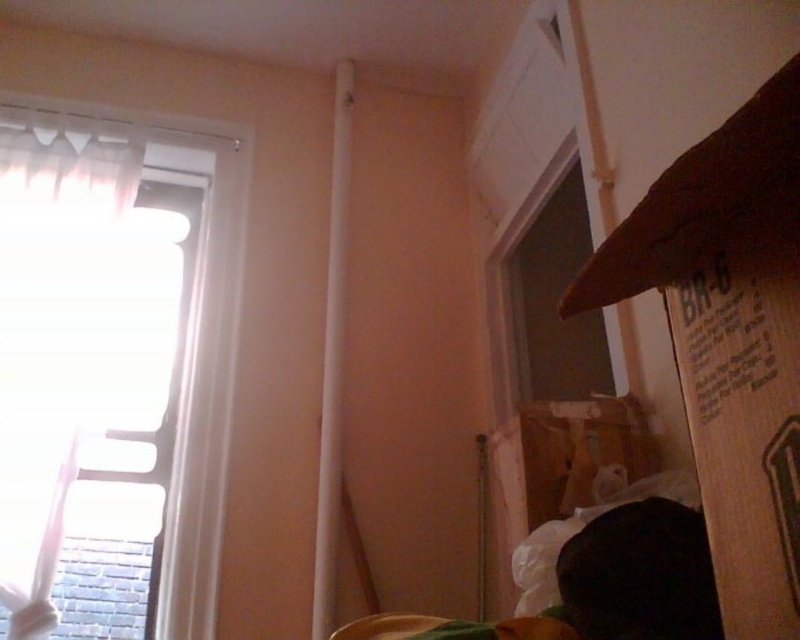
Based on the photo, you are moving a brown cardboard box at lower right into a room with a white sheer curtain at left. If you want to place the box near the window, which side of the curtain should you position it on?

The brown cardboard box at lower right should be placed to the right of the white sheer curtain at left since the curtain is already positioned to the left of the box.

You are moving a brown cardboard box at lower right into a room with a white sheer curtain at left. The box is 3 feet wide. Is there enough space between the box and the curtain to move it without touching either?

The white sheer curtain at left is 3.63 feet away from the brown cardboard box at lower right. Since the box is 3 feet wide, there is sufficient space between them to move it without touching either.

In the scene shown: You are moving into a new apartment and have two brown cardboard boxes to place in the room. The brown cardboard box at right and the brown cardboard box at lower right. Which box should you choose if you need to store smaller items?

The brown cardboard box at right is smaller than the brown cardboard box at lower right, so you should choose the brown cardboard box at right to store smaller items.